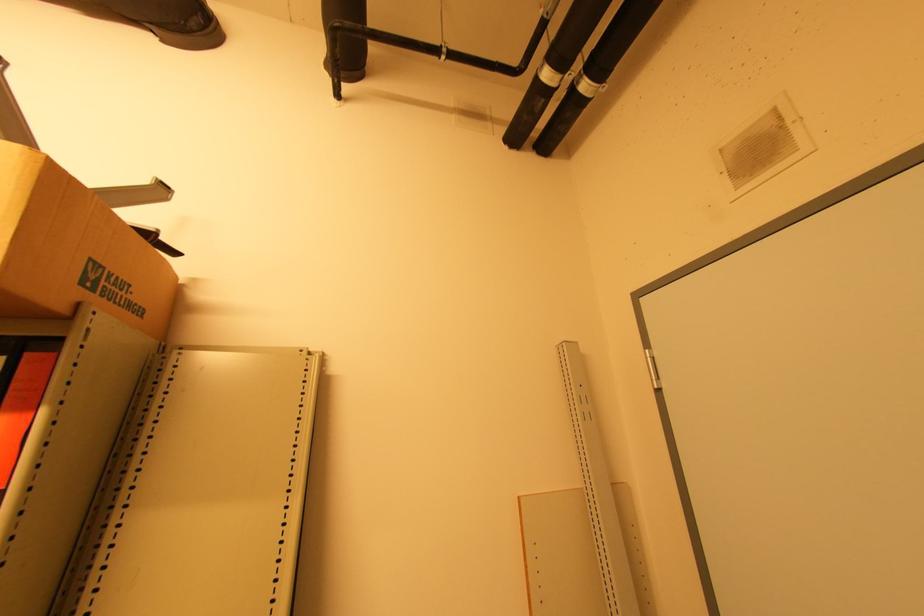
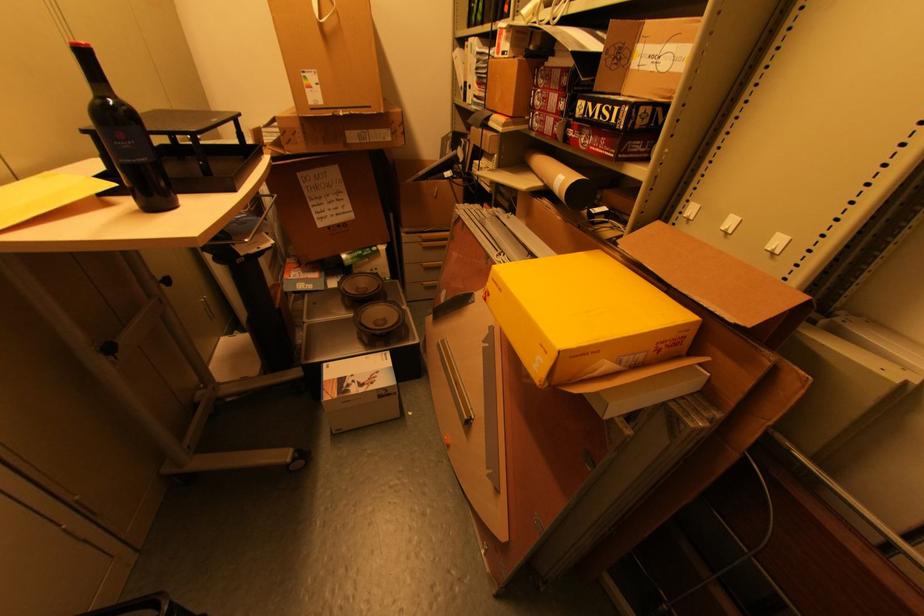
How did the camera likely rotate?

The rotation direction of the camera is left-down.